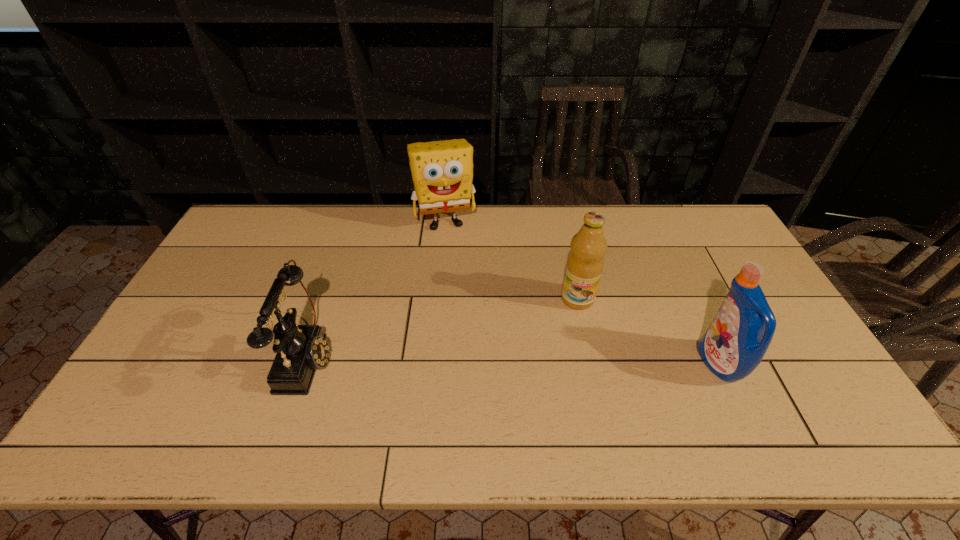
The width and height of the screenshot is (960, 540). I want to click on vacant space located 0.110m on the label of the detergent, so click(x=660, y=364).

I want to click on vacant space situated 0.090m on the label of the olive oil, so click(x=571, y=334).

The width and height of the screenshot is (960, 540). I want to click on vacant point located on the label of the olive oil, so click(564, 369).

The width and height of the screenshot is (960, 540). I want to click on vacant position located 0.310m on the label of the olive oil, so click(559, 402).

Find the location of a particular element. The image size is (960, 540). blank space located on the face of the second object from left to right is located at coordinates (469, 310).

The height and width of the screenshot is (540, 960). I want to click on free location located 0.160m on the face of the second object from left to right, so click(x=458, y=267).

At what (x,y) coordinates should I click in order to perform the action: click on vacant region located on the face of the second object from left to right. Please return your answer as a coordinate pair (x, y). Looking at the image, I should click on (457, 263).

This screenshot has width=960, height=540. I want to click on object located in the far edge section of the desktop, so click(x=442, y=171).

Locate an element on the screen. Image resolution: width=960 pixels, height=540 pixels. telephone that is at the near edge is located at coordinates (301, 349).

Identify the location of detergent that is at the near edge. (734, 344).